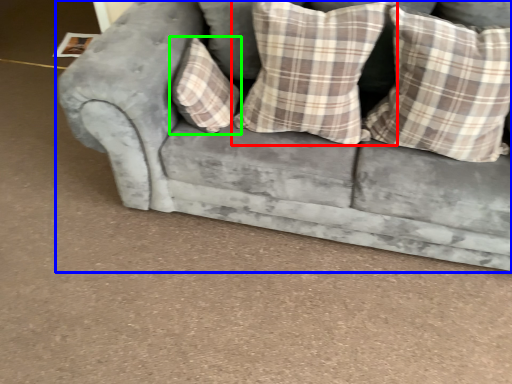
Question: Which object is the closest to the pillow (highlighted by a red box)? Choose among these: studio couch (highlighted by a blue box) or pillow (highlighted by a green box).

Choices:
 (A) studio couch
 (B) pillow

Answer: (B)